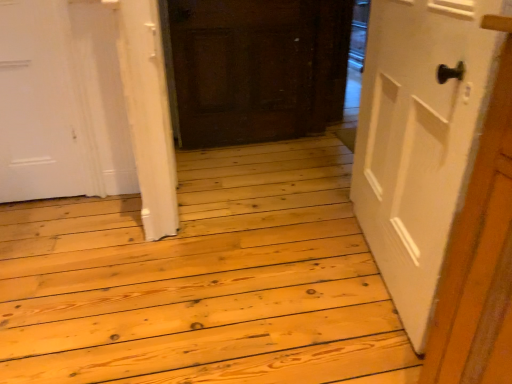
Question: Is dark brown wood door at center, placed as the second door when sorted from right to left, bigger than white matte door at right, the second door from the back?

Choices:
 (A) no
 (B) yes

Answer: (A)

Question: Can you confirm if dark brown wood door at center, which is counted as the 1th door, starting from the back, is taller than white matte door at right, the second door from the back?

Choices:
 (A) yes
 (B) no

Answer: (B)

Question: Can you confirm if dark brown wood door at center, which is counted as the 1th door, starting from the back, is shorter than white matte door at right, which is counted as the second door, starting from the left?

Choices:
 (A) no
 (B) yes

Answer: (B)

Question: From a real-world perspective, is dark brown wood door at center, placed as the second door when sorted from right to left, positioned over white matte door at right, the second door from the back, based on gravity?

Choices:
 (A) yes
 (B) no

Answer: (B)

Question: From a real-world perspective, is dark brown wood door at center, which is counted as the 1th door, starting from the back, below white matte door at right, which is counted as the second door, starting from the left?

Choices:
 (A) no
 (B) yes

Answer: (B)

Question: Is the depth of dark brown wood door at center, placed as the second door when sorted from right to left, greater than that of white matte door at right, acting as the 1th door starting from the front?

Choices:
 (A) no
 (B) yes

Answer: (B)

Question: Is white matte door at right, the second door from the back, bigger than dark brown wood door at center, which is counted as the 1th door, starting from the back?

Choices:
 (A) no
 (B) yes

Answer: (B)

Question: Are white matte door at right, the second door from the back, and dark brown wood door at center, the 1th door viewed from the left, making contact?

Choices:
 (A) no
 (B) yes

Answer: (A)

Question: Is white matte door at right, the second door from the back, in front of dark brown wood door at center, which is counted as the 1th door, starting from the back?

Choices:
 (A) yes
 (B) no

Answer: (A)

Question: Is white matte door at right, which is the 1th door in right-to-left order, oriented away from dark brown wood door at center, placed as the second door when sorted from front to back?

Choices:
 (A) no
 (B) yes

Answer: (A)

Question: From a real-world perspective, is white matte door at right, which is counted as the second door, starting from the left, located beneath dark brown wood door at center, placed as the second door when sorted from front to back?

Choices:
 (A) yes
 (B) no

Answer: (B)

Question: Does white matte door at right, which is the 1th door in right-to-left order, come behind dark brown wood door at center, placed as the second door when sorted from right to left?

Choices:
 (A) yes
 (B) no

Answer: (B)

Question: Considering the positions of point (377, 67) and point (228, 3), is point (377, 67) closer or farther from the camera than point (228, 3)?

Choices:
 (A) farther
 (B) closer

Answer: (B)